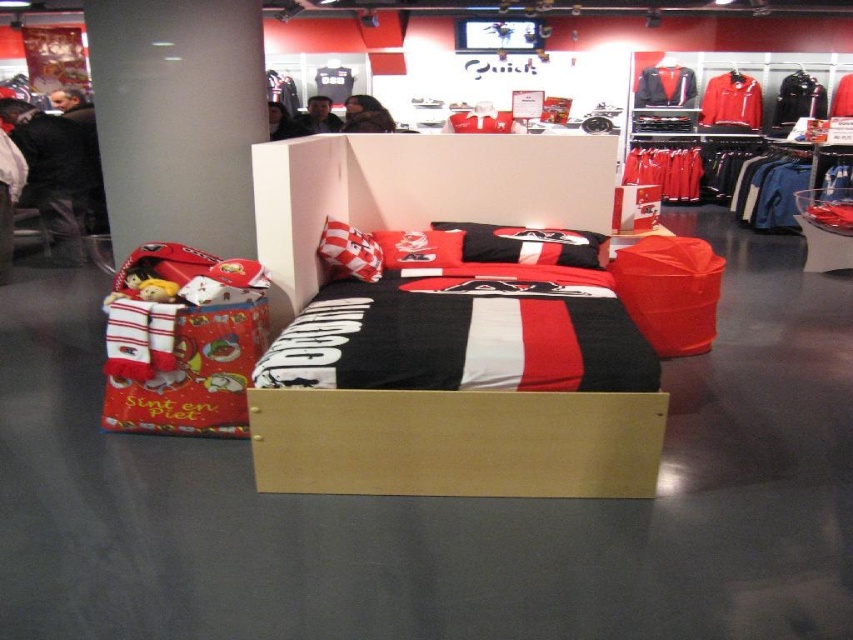
Between black cotton shirt at left and black leather jacket at center, which one is positioned higher?

black leather jacket at center is higher up.

What do you see at coordinates (51, 173) in the screenshot?
I see `black cotton shirt at left` at bounding box center [51, 173].

The height and width of the screenshot is (640, 853). Find the location of `black cotton shirt at left`. black cotton shirt at left is located at coordinates (51, 173).

Between black leather jacket at center and matte black jacket at center, which one is positioned higher?

black leather jacket at center is higher up.

Which is behind, point (643, 93) or point (323, 131)?

The point (643, 93) is behind.

Find the location of `black leather jacket at center`. black leather jacket at center is located at coordinates (664, 86).

Does point (737, 116) come farther from viewer compared to point (642, 99)?

No, (737, 116) is closer to viewer.

Who is more distant from viewer, (701, 99) or (664, 90)?

Positioned behind is point (701, 99).

The width and height of the screenshot is (853, 640). Identify the location of red polyester jacket at center. (730, 100).

I want to click on red polyester jacket at center, so click(x=730, y=100).